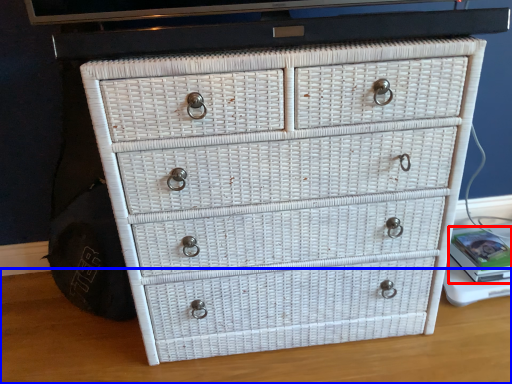
Question: Among these objects, which one is nearest to the camera, book (highlighted by a red box) or table top (highlighted by a blue box)?

Choices:
 (A) book
 (B) table top

Answer: (B)